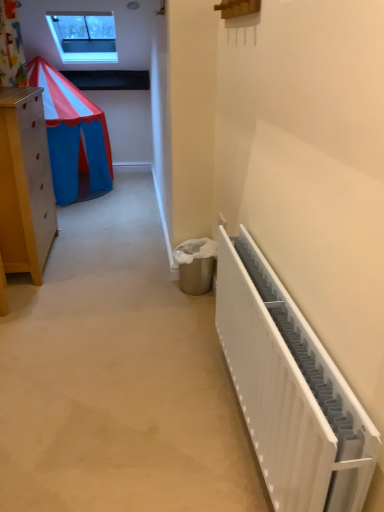
What do you see at coordinates (84, 36) in the screenshot? This screenshot has width=384, height=512. I see `transparent glass window at upper center` at bounding box center [84, 36].

Where is `transparent glass window at upper center`? transparent glass window at upper center is located at coordinates (84, 36).

Locate an element on the screen. This screenshot has width=384, height=512. white matte radiator at right is located at coordinates (290, 389).

This screenshot has height=512, width=384. Describe the element at coordinates (290, 389) in the screenshot. I see `white matte radiator at right` at that location.

Where is `transparent glass window at upper center`? Image resolution: width=384 pixels, height=512 pixels. transparent glass window at upper center is located at coordinates (84, 36).

Considering the relative positions of white matte radiator at right and transparent glass window at upper center in the image provided, is white matte radiator at right to the left of transparent glass window at upper center from the viewer's perspective?

No.

Does white matte radiator at right lie in front of transparent glass window at upper center?

Yes, it is in front of transparent glass window at upper center.

Considering the points (238, 258) and (51, 23), which point is in front, point (238, 258) or point (51, 23)?

The point (238, 258) is more forward.

From the image's perspective, which object appears higher, white matte radiator at right or transparent glass window at upper center?

transparent glass window at upper center appears higher in the image.

From a real-world perspective, is white matte radiator at right positioned above or below transparent glass window at upper center?

white matte radiator at right is situated lower than transparent glass window at upper center in the real world.

Looking at their sizes, would you say white matte radiator at right is wider or thinner than transparent glass window at upper center?

Clearly, white matte radiator at right has less width compared to transparent glass window at upper center.

Does white matte radiator at right have a greater height compared to transparent glass window at upper center?

Yes.

Looking at the image, does white matte radiator at right seem bigger or smaller compared to transparent glass window at upper center?

Considering their sizes, white matte radiator at right takes up less space than transparent glass window at upper center.

Is white matte radiator at right situated inside transparent glass window at upper center or outside?

white matte radiator at right is located beyond the bounds of transparent glass window at upper center.

Can you see white matte radiator at right touching transparent glass window at upper center?

No.

Is white matte radiator at right oriented away from transparent glass window at upper center?

white matte radiator at right is not turned away from transparent glass window at upper center.

You are a GUI agent. You are given a task and a screenshot of the screen. Output one action in this format:
    pyautogui.click(x=<x>, y=<y>)
    Task: Click on the radiator that appears below the transparent glass window at upper center (from the image's perspective)
    This screenshot has width=384, height=512.
    Given the screenshot: What is the action you would take?
    pyautogui.click(x=290, y=389)

Can you confirm if transparent glass window at upper center is positioned to the left of white matte radiator at right?

Yes.

In the image, is transparent glass window at upper center positioned in front of or behind white matte radiator at right?

Clearly, transparent glass window at upper center is behind white matte radiator at right.

Is point (62, 26) farther from camera compared to point (254, 247)?

That is True.

From the image's perspective, between transparent glass window at upper center and white matte radiator at right, which one is located above?

transparent glass window at upper center appears higher in the image.

From a real-world perspective, between transparent glass window at upper center and white matte radiator at right, who is vertically lower?

white matte radiator at right is physically lower.

Between transparent glass window at upper center and white matte radiator at right, which one has larger width?

transparent glass window at upper center is wider.

Between transparent glass window at upper center and white matte radiator at right, which one has less height?

transparent glass window at upper center is shorter.

Does transparent glass window at upper center have a larger size compared to white matte radiator at right?

Yes.

Would you say transparent glass window at upper center is outside white matte radiator at right?

Yes, transparent glass window at upper center is outside of white matte radiator at right.

Does transparent glass window at upper center touch white matte radiator at right?

No, transparent glass window at upper center is not in contact with white matte radiator at right.

Is white matte radiator at right at the back of transparent glass window at upper center?

No, transparent glass window at upper center's orientation is not away from white matte radiator at right.

How many degrees apart are the facing directions of transparent glass window at upper center and white matte radiator at right?

The angular difference between transparent glass window at upper center and white matte radiator at right is 90 degrees.

How far apart are transparent glass window at upper center and white matte radiator at right?

A distance of 11.74 feet exists between transparent glass window at upper center and white matte radiator at right.

Where is `radiator on the right side of transparent glass window at upper center`? The image size is (384, 512). radiator on the right side of transparent glass window at upper center is located at coordinates (290, 389).

I want to click on radiator located below the transparent glass window at upper center (from the image's perspective), so click(x=290, y=389).

You are a GUI agent. You are given a task and a screenshot of the screen. Output one action in this format:
    pyautogui.click(x=<x>, y=<y>)
    Task: Click on the radiator that appears below the transparent glass window at upper center (from a real-world perspective)
    The width and height of the screenshot is (384, 512).
    Given the screenshot: What is the action you would take?
    pyautogui.click(x=290, y=389)